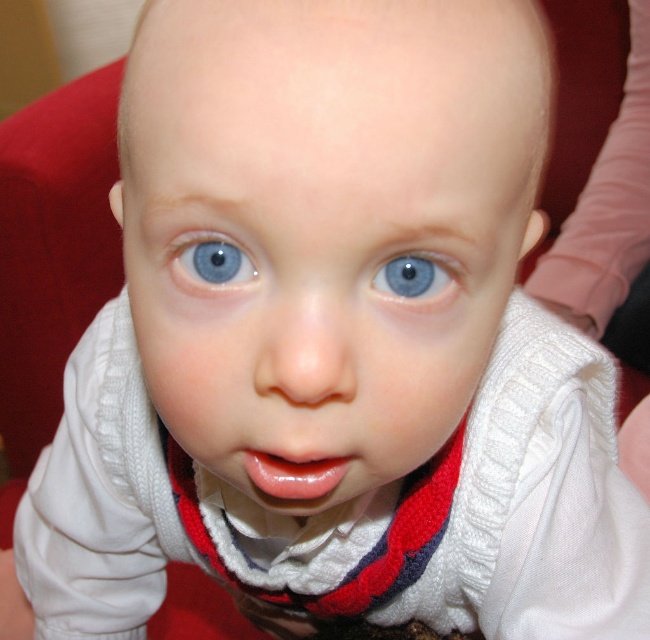
You are a photographer trying to focus on the glossy pink lips at center in the image. What are the exact coordinates where you should adjust your focus to ensure sharpness?

The glossy pink lips at center are located at the 2D coordinates point (x=292, y=476), so you should adjust your focus to that point to ensure sharpness.

You are a photographer adjusting the focus on your camera. The baby in the image has two main features at the center of the frame. You want to ensure both the glossy pink lips at center and the blue smooth eye at center are in focus. Given that your camera can only maintain sharp focus within a 2.5 inch range, will both features be in focus?

The glossy pink lips at center is 2.60 inches away from blue smooth eye at center. Since the distance between them exceeds the camera focus range of 2.5 inches, the camera cannot keep both in focus simultaneously.

You are a photographer trying to adjust the focus on your camera. The baby is currently in focus, but you want to shift the focus to a point that is 10 inches away from the camera. Is the point at point (x=198, y=237) within the desired focus range?

The distance of point (x=198, y=237) from camera is 9.45 inches, so it is within the desired focus range of 10 inches.